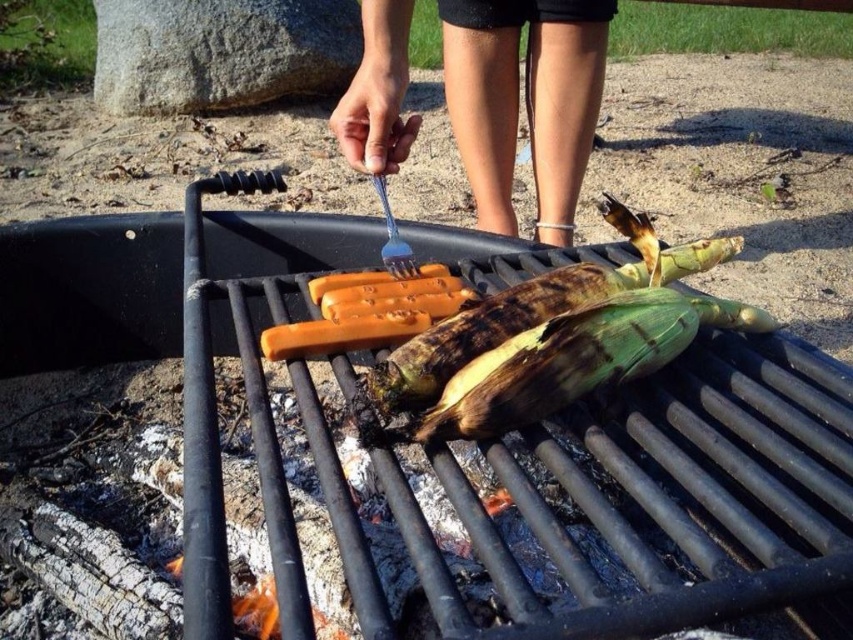
Is point (723, 564) positioned in front of point (485, 147)?

Yes, point (723, 564) is in front of point (485, 147).

Is black matte grill at center to the left of skinny blue plastic fork at upper center from the viewer's perspective?

Correct, you'll find black matte grill at center to the left of skinny blue plastic fork at upper center.

Does point (840, 545) come in front of point (505, 90)?

Yes, it is in front of point (505, 90).

What are the coordinates of `black matte grill at center` in the screenshot? It's located at (666, 497).

Is black matte grill at center thinner than charred corn at center?

Incorrect, black matte grill at center's width is not less than charred corn at center's.

Is point (347, 579) positioned in front of point (572, 275)?

Yes.

Image resolution: width=853 pixels, height=640 pixels. Identify the location of black matte grill at center. (666, 497).

Is black matte grill at center further to camera compared to blue plastic fork at center?

No.

What do you see at coordinates (666, 497) in the screenshot? I see `black matte grill at center` at bounding box center [666, 497].

Does point (103, 296) come behind point (415, 269)?

Yes, point (103, 296) is farther from viewer.

Where is `black matte grill at center`? The image size is (853, 640). black matte grill at center is located at coordinates (x=666, y=497).